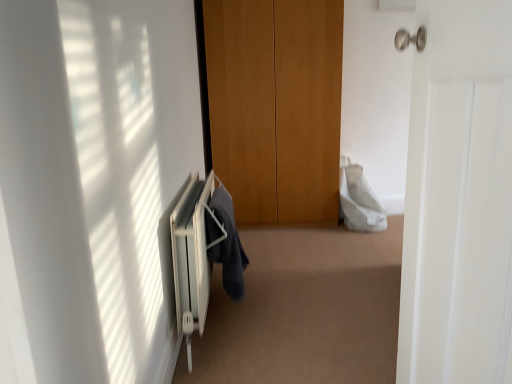
This screenshot has height=384, width=512. Find the location of `white matte door at right`. white matte door at right is located at coordinates (459, 199).

Identify the location of white metallic radiator at lower left. (191, 258).

Identify the location of dark gray fabric at lower center. (226, 243).

Would you say white metallic radiator at lower left is inside or outside white matte door at right?

white metallic radiator at lower left is outside white matte door at right.

Between white metallic radiator at lower left and white matte door at right, which one appears on the right side from the viewer's perspective?

From the viewer's perspective, white matte door at right appears more on the right side.

Considering the sizes of white metallic radiator at lower left and white matte door at right in the image, is white metallic radiator at lower left taller or shorter than white matte door at right?

In the image, white metallic radiator at lower left appears to be shorter than white matte door at right.

From the image's perspective, is white metallic radiator at lower left located above or below white matte door at right?

From the image's perspective, white metallic radiator at lower left appears below white matte door at right.

Relative to white matte door at right, is dark gray fabric at lower center in front or behind?

dark gray fabric at lower center is positioned farther from the viewer than white matte door at right.

Which is closer to the camera, (237, 236) or (485, 87)?

Point (237, 236) is positioned farther from the camera compared to point (485, 87).

Does dark gray fabric at lower center have a larger size compared to white matte door at right?

Incorrect, dark gray fabric at lower center is not larger than white matte door at right.

Does dark gray fabric at lower center turn towards white metallic radiator at lower left?

Yes, dark gray fabric at lower center faces towards white metallic radiator at lower left.

In the image, is dark gray fabric at lower center positioned in front of or behind white metallic radiator at lower left?

dark gray fabric at lower center is positioned farther from the viewer than white metallic radiator at lower left.

Which is more to the right, dark gray fabric at lower center or white metallic radiator at lower left?

Positioned to the right is dark gray fabric at lower center.

In terms of size, does dark gray fabric at lower center appear bigger or smaller than white metallic radiator at lower left?

dark gray fabric at lower center is smaller than white metallic radiator at lower left.

Between white matte door at right and white metallic radiator at lower left, which one has more height?

With more height is white matte door at right.

Is the position of white matte door at right more distant than that of white metallic radiator at lower left?

That is False.

Measure the distance between white matte door at right and white metallic radiator at lower left.

white matte door at right and white metallic radiator at lower left are 38.81 inches apart from each other.

Could you tell me if white metallic radiator at lower left is turned towards dark gray fabric at lower center?

Yes, white metallic radiator at lower left faces towards dark gray fabric at lower center.

Is white metallic radiator at lower left not near dark gray fabric at lower center?

white metallic radiator at lower left is actually quite close to dark gray fabric at lower center.

From the image's perspective, between white metallic radiator at lower left and dark gray fabric at lower center, who is located below?

white metallic radiator at lower left is shown below in the image.

Between white metallic radiator at lower left and dark gray fabric at lower center, which one appears on the left side from the viewer's perspective?

white metallic radiator at lower left.

How distant is white matte door at right from dark gray fabric at lower center?

They are 1.06 meters apart.

At what (x,y) coordinates should I click in order to perform the action: click on door located above the dark gray fabric at lower center (from the image's perspective). Please return your answer as a coordinate pair (x, y). This screenshot has height=384, width=512. Looking at the image, I should click on (459, 199).

Considering the sizes of objects white matte door at right and dark gray fabric at lower center in the image provided, who is smaller, white matte door at right or dark gray fabric at lower center?

With smaller size is dark gray fabric at lower center.

Choose the correct answer: Is white matte door at right inside dark gray fabric at lower center or outside it?

The correct answer is: outside.

The height and width of the screenshot is (384, 512). In order to click on radiator that appears behind the white matte door at right in this screenshot , I will do `click(191, 258)`.

Where is `door positioned vertically above the dark gray fabric at lower center (from a real-world perspective)`? door positioned vertically above the dark gray fabric at lower center (from a real-world perspective) is located at coordinates (459, 199).

Considering their positions, is white matte door at right positioned closer to dark gray fabric at lower center than white metallic radiator at lower left?

The object closer to dark gray fabric at lower center is white metallic radiator at lower left.

Considering their positions, is white metallic radiator at lower left positioned further to white matte door at right than dark gray fabric at lower center?

dark gray fabric at lower center lies further to white matte door at right than the other object.

When comparing their distances from white metallic radiator at lower left, does white matte door at right or dark gray fabric at lower center seem closer?

dark gray fabric at lower center is positioned closer to the anchor white metallic radiator at lower left.

Consider the image. Estimate the real-world distances between objects in this image. Which object is closer to white matte door at right, dark gray fabric at lower center or white metallic radiator at lower left?

Among the two, white metallic radiator at lower left is located nearer to white matte door at right.

When comparing their distances from dark gray fabric at lower center, does white metallic radiator at lower left or white matte door at right seem further?

white matte door at right is further to dark gray fabric at lower center.

Which object lies further to the anchor point white metallic radiator at lower left, dark gray fabric at lower center or white matte door at right?

Among the two, white matte door at right is located further to white metallic radiator at lower left.

In order to click on radiator between white matte door at right and dark gray fabric at lower center in the front-back direction in this screenshot , I will do click(191, 258).